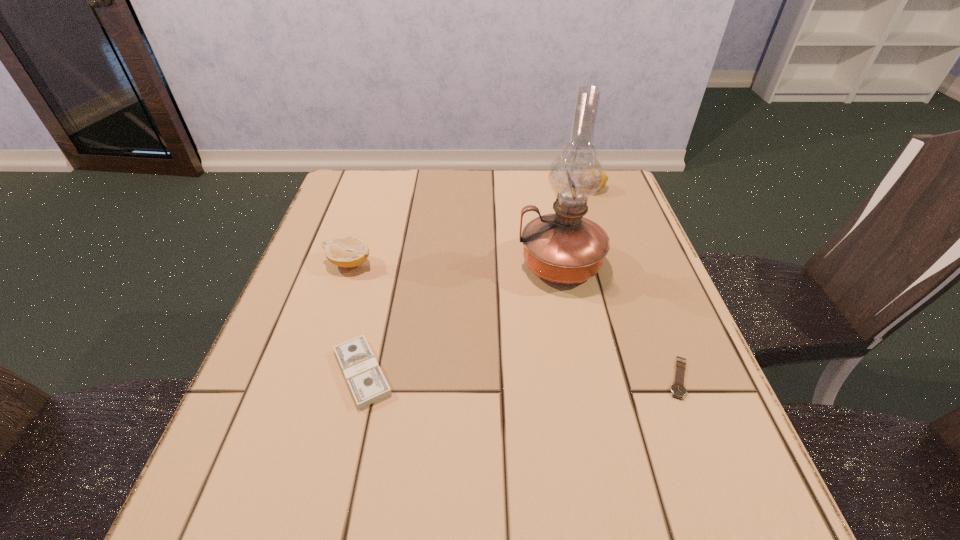
In order to click on oil lamp in this screenshot , I will do `click(563, 247)`.

You are a GUI agent. You are given a task and a screenshot of the screen. Output one action in this format:
    pyautogui.click(x=<x>, y=<y>)
    Task: Click on the fourth shortest object
    The width and height of the screenshot is (960, 540).
    Given the screenshot: What is the action you would take?
    pyautogui.click(x=605, y=179)

Find the location of a particular element. the farthest object is located at coordinates (605, 179).

At what (x,y) coordinates should I click in order to perform the action: click on the left lemon. Please return your answer as a coordinate pair (x, y). Looking at the image, I should click on (347, 251).

At what (x,y) coordinates should I click in order to perform the action: click on the third shortest object. Please return your answer as a coordinate pair (x, y). Looking at the image, I should click on click(x=347, y=251).

Locate an element on the screen. The height and width of the screenshot is (540, 960). dollar is located at coordinates (368, 385).

Where is `watch`? watch is located at coordinates (678, 390).

You are a GUI agent. You are given a task and a screenshot of the screen. Output one action in this format:
    pyautogui.click(x=<x>, y=<y>)
    Task: Click on the free location located on the back of the tallest object
    
    Given the screenshot: What is the action you would take?
    pyautogui.click(x=543, y=180)

Locate an element on the screen. The width and height of the screenshot is (960, 540). vacant space located 0.180m at the stem end of the farther lemon is located at coordinates (514, 189).

Where is `free space located at the stem end of the farther lemon`? This screenshot has width=960, height=540. free space located at the stem end of the farther lemon is located at coordinates (448, 189).